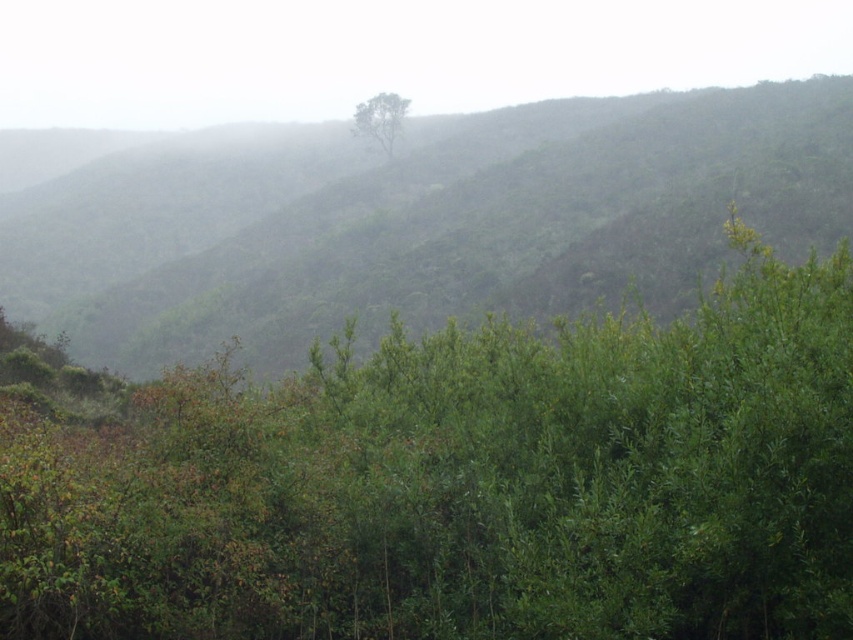
Question: Which object appears closest to the camera in this image?

Choices:
 (A) green leafy tree at center
 (B) green leafy hillside at center
 (C) green leafy tree at upper center

Answer: (A)

Question: Based on their relative distances, which object is nearer to the green leafy hillside at center?

Choices:
 (A) green leafy tree at upper center
 (B) green leafy tree at center

Answer: (A)

Question: Is green leafy tree at center above green leafy tree at upper center?

Choices:
 (A) no
 (B) yes

Answer: (A)

Question: Is green leafy tree at center closer to the viewer compared to green leafy hillside at center?

Choices:
 (A) no
 (B) yes

Answer: (B)

Question: Which object is positioned farthest from the green leafy hillside at center?

Choices:
 (A) green leafy tree at upper center
 (B) green leafy tree at center

Answer: (B)

Question: Is green leafy tree at center wider than green leafy tree at upper center?

Choices:
 (A) yes
 (B) no

Answer: (B)